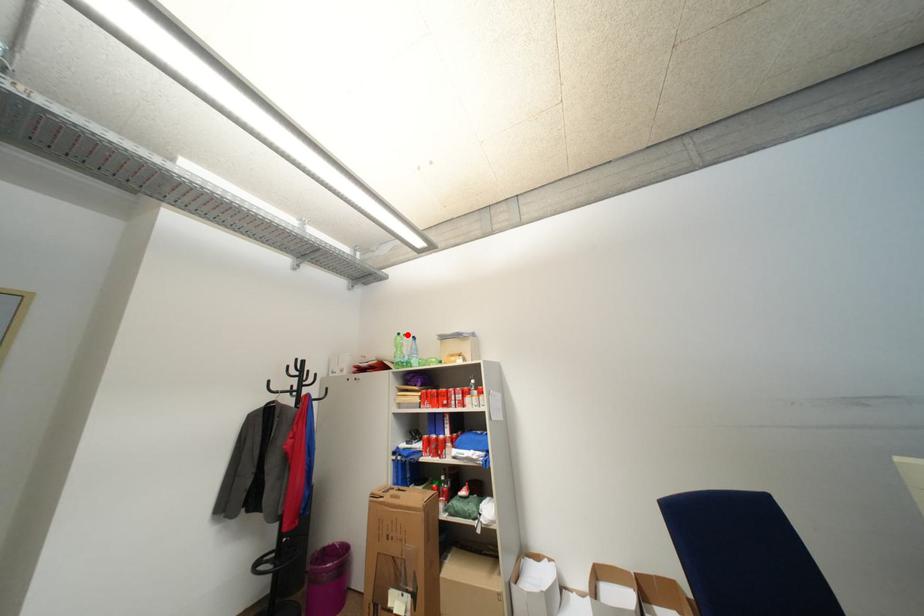
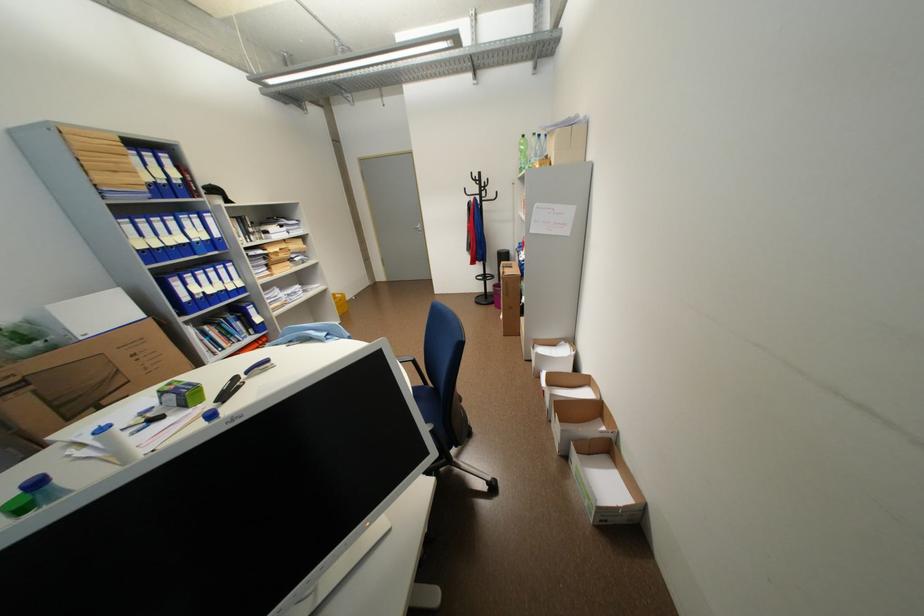
Question: I am providing you with two images of the same scene from different viewpoints. Given a red point in image1, look at the same physical point in image2. Is it:

Choices:
 (A) Closer to the viewpoint
 (B) Farther from the viewpoint

Answer: (A)